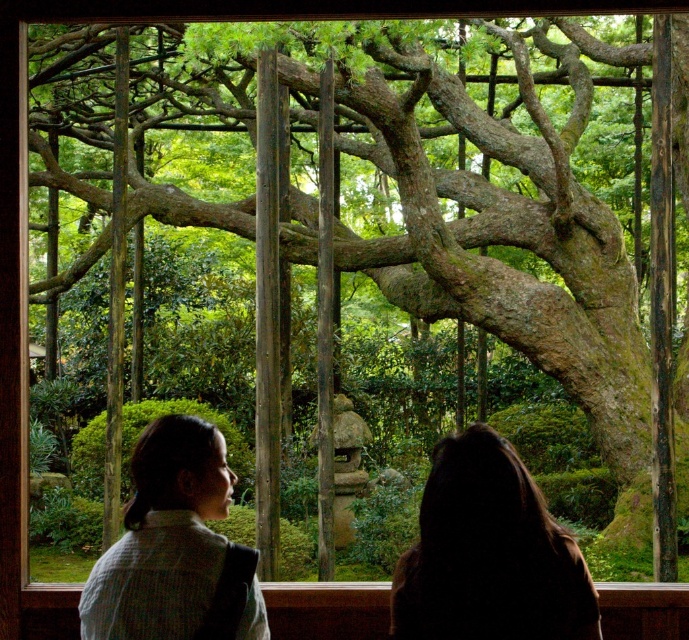
Based on the scene described, where is the dark brown hair at upper center located in the image?

The dark brown hair at upper center is located at point (489,554) in the image.

You are looking through a wooden window frame and see a dark brown hair at upper center and a white textured sweater at lower left. Which object is positioned higher in the scene?

The dark brown hair at upper center is positioned higher than the white textured sweater at lower left.

You are looking through the wooden window frame and notice two items in the scene. The dark brown hair at upper center and the white textured sweater at lower left. Which item is positioned closer to you?

The dark brown hair at upper center is closer to the viewer than the white textured sweater at lower left.